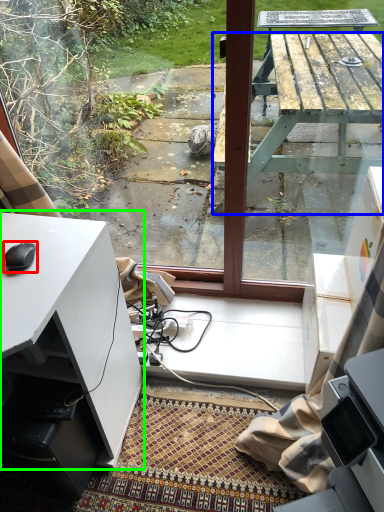
Question: Which object is positioned farthest from mouse (highlighted by a red box)? Select from table (highlighted by a blue box) and desk (highlighted by a green box).

Choices:
 (A) table
 (B) desk

Answer: (A)